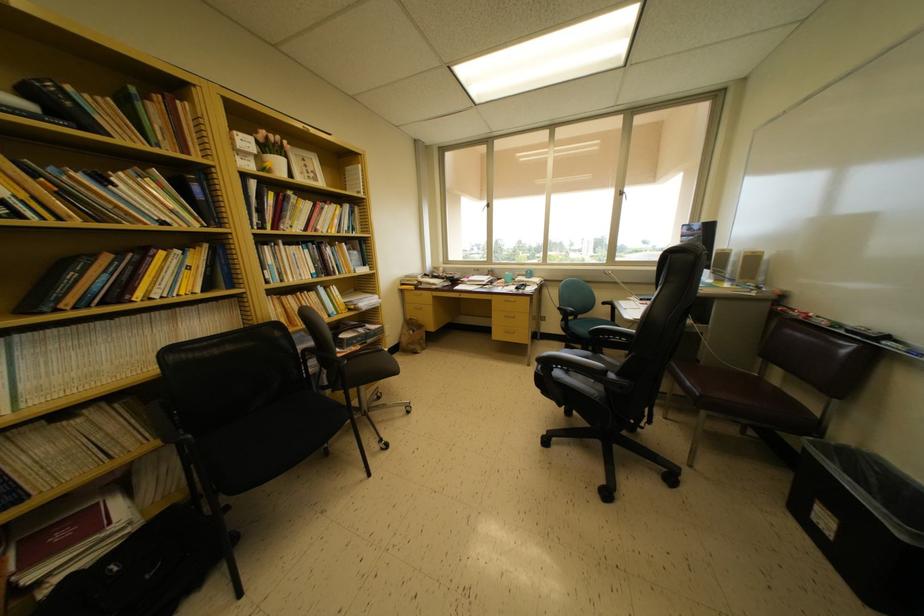
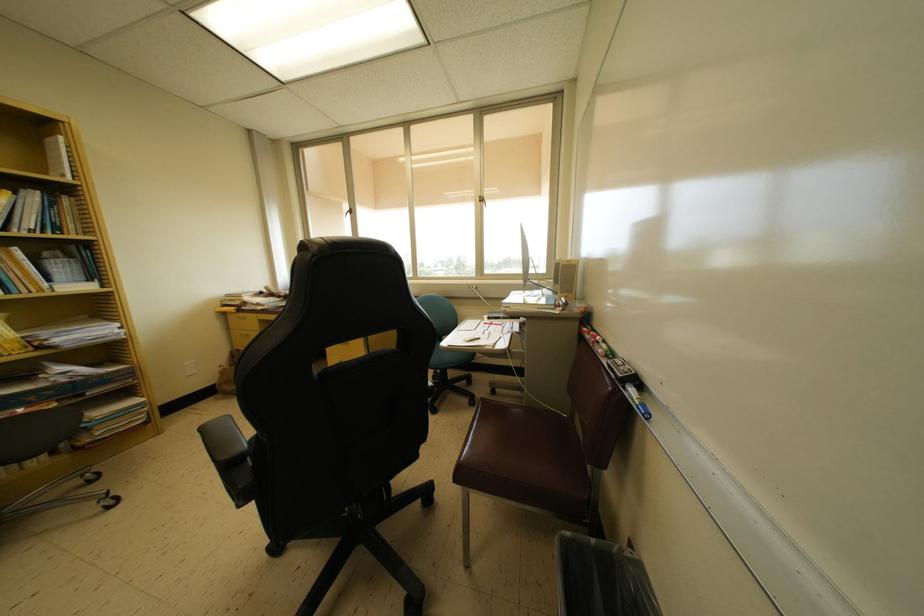
Find the pixel in the second image that matches pixel 363 171 in the first image.

(65, 143)